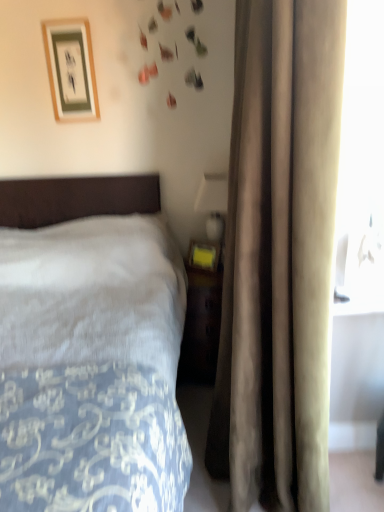
Image resolution: width=384 pixels, height=512 pixels. Describe the element at coordinates (213, 203) in the screenshot. I see `matte yellow plastic at right` at that location.

The height and width of the screenshot is (512, 384). What do you see at coordinates (279, 255) in the screenshot? I see `beige velvet curtain at right` at bounding box center [279, 255].

Image resolution: width=384 pixels, height=512 pixels. What are the coordinates of `white soft bed at left` in the screenshot? It's located at (91, 440).

From the image's perspective, does beige velvet curtain at right appear higher than matte gold picture frame at upper left?

No, from the image's perspective, beige velvet curtain at right is not on top of matte gold picture frame at upper left.

Is beige velvet curtain at right positioned far away from matte gold picture frame at upper left?

beige velvet curtain at right is positioned a significant distance from matte gold picture frame at upper left.

Is the depth of beige velvet curtain at right greater than that of matte gold picture frame at upper left?

No, it is in front of matte gold picture frame at upper left.

Measure the distance between beige velvet curtain at right and matte gold picture frame at upper left.

beige velvet curtain at right and matte gold picture frame at upper left are 4.88 feet apart.

In the scene shown: Would you consider white soft bed at left to be distant from matte yellow plastic at right?

That's right, there is a large distance between white soft bed at left and matte yellow plastic at right.

Is matte yellow plastic at right surrounded by white soft bed at left?

No, matte yellow plastic at right is located outside of white soft bed at left.

Is white soft bed at left behind matte yellow plastic at right?

No, it is not.

Considering the points (135, 219) and (210, 189), which point is in front, point (135, 219) or point (210, 189)?

Positioned in front is point (210, 189).

Looking at this image, are matte yellow plastic at right and matte gold picture frame at upper left far apart?

They are positioned close to each other.

Considering the sizes of objects matte yellow plastic at right and matte gold picture frame at upper left in the image provided, who is taller, matte yellow plastic at right or matte gold picture frame at upper left?

With more height is matte yellow plastic at right.

From a real-world perspective, does matte yellow plastic at right sit lower than matte gold picture frame at upper left?

Yes, from a real-world perspective, matte yellow plastic at right is under matte gold picture frame at upper left.

Can you confirm if matte gold picture frame at upper left is smaller than white soft bed at left?

Yes, matte gold picture frame at upper left is smaller than white soft bed at left.

Does matte gold picture frame at upper left appear on the right side of white soft bed at left?

Yes.

Considering the relative sizes of matte gold picture frame at upper left and white soft bed at left in the image provided, is matte gold picture frame at upper left taller than white soft bed at left?

In fact, matte gold picture frame at upper left may be shorter than white soft bed at left.

Can you tell me how much matte gold picture frame at upper left and white soft bed at left differ in facing direction?

0.000189 degrees.

Considering the sizes of white soft bed at left and beige velvet curtain at right in the image, is white soft bed at left taller or shorter than beige velvet curtain at right?

white soft bed at left is shorter than beige velvet curtain at right.

Does point (153, 371) appear closer or farther from the camera than point (303, 16)?

Point (153, 371) appears to be farther away from the viewer than point (303, 16).

How many degrees apart are the facing directions of white soft bed at left and beige velvet curtain at right?

90 degrees separate the facing orientations of white soft bed at left and beige velvet curtain at right.

Is white soft bed at left located outside beige velvet curtain at right?

Yes, white soft bed at left is located beyond the bounds of beige velvet curtain at right.

Considering the positions of objects matte gold picture frame at upper left and beige velvet curtain at right in the image provided, who is behind, matte gold picture frame at upper left or beige velvet curtain at right?

matte gold picture frame at upper left is further away from the camera.

How distant is matte gold picture frame at upper left from beige velvet curtain at right?

The distance of matte gold picture frame at upper left from beige velvet curtain at right is 4.88 feet.

From a real-world perspective, is matte gold picture frame at upper left above or below beige velvet curtain at right?

In terms of real-world spatial position, matte gold picture frame at upper left is above beige velvet curtain at right.

Based on the photo, considering the positions of objects matte gold picture frame at upper left and beige velvet curtain at right in the image provided, who is more to the right, matte gold picture frame at upper left or beige velvet curtain at right?

From the viewer's perspective, beige velvet curtain at right appears more on the right side.

Is white soft bed at left with matte gold picture frame at upper left?

No, white soft bed at left is not touching matte gold picture frame at upper left.

In the scene shown: Which is farther, (38, 434) or (51, 78)?

The point (51, 78) is farther from the camera.

Consider the image. From the image's perspective, is white soft bed at left above matte gold picture frame at upper left?

No, from the image's perspective, white soft bed at left is not over matte gold picture frame at upper left.

Identify the location of picture frame positioned vertically above the white soft bed at left (from a real-world perspective). (71, 70).

Where is `curtain below the matte gold picture frame at upper left (from the image's perspective)`? curtain below the matte gold picture frame at upper left (from the image's perspective) is located at coordinates (279, 255).

Identify the location of bed that appears below the matte yellow plastic at right (from a real-world perspective). (91, 440).

From the image, which object appears to be nearer to white soft bed at left, beige velvet curtain at right or matte yellow plastic at right?

beige velvet curtain at right.

Considering their positions, is white soft bed at left positioned closer to matte gold picture frame at upper left than matte yellow plastic at right?

matte yellow plastic at right.

Estimate the real-world distances between objects in this image. Which object is closer to matte yellow plastic at right, matte gold picture frame at upper left or beige velvet curtain at right?

matte gold picture frame at upper left lies closer to matte yellow plastic at right than the other object.

When comparing their distances from beige velvet curtain at right, does matte gold picture frame at upper left or white soft bed at left seem further?

matte gold picture frame at upper left.

Which object lies nearer to the anchor point white soft bed at left, matte yellow plastic at right or beige velvet curtain at right?

beige velvet curtain at right.

Estimate the real-world distances between objects in this image. Which object is closer to white soft bed at left, matte yellow plastic at right or matte gold picture frame at upper left?

The object closer to white soft bed at left is matte yellow plastic at right.

Considering their positions, is matte yellow plastic at right positioned further to matte gold picture frame at upper left than white soft bed at left?

white soft bed at left.

From the image, which object appears to be nearer to matte gold picture frame at upper left, beige velvet curtain at right or white soft bed at left?

beige velvet curtain at right is closer to matte gold picture frame at upper left.

Where is `table lamp between beige velvet curtain at right and matte gold picture frame at upper left along the z-axis`? table lamp between beige velvet curtain at right and matte gold picture frame at upper left along the z-axis is located at coordinates (213, 203).

The height and width of the screenshot is (512, 384). In order to click on table lamp positioned between white soft bed at left and matte gold picture frame at upper left from near to far in this screenshot , I will do `click(213, 203)`.

I want to click on curtain located between white soft bed at left and matte gold picture frame at upper left in the depth direction, so click(279, 255).

Identify the location of curtain positioned between white soft bed at left and matte yellow plastic at right from near to far. The width and height of the screenshot is (384, 512). (279, 255).